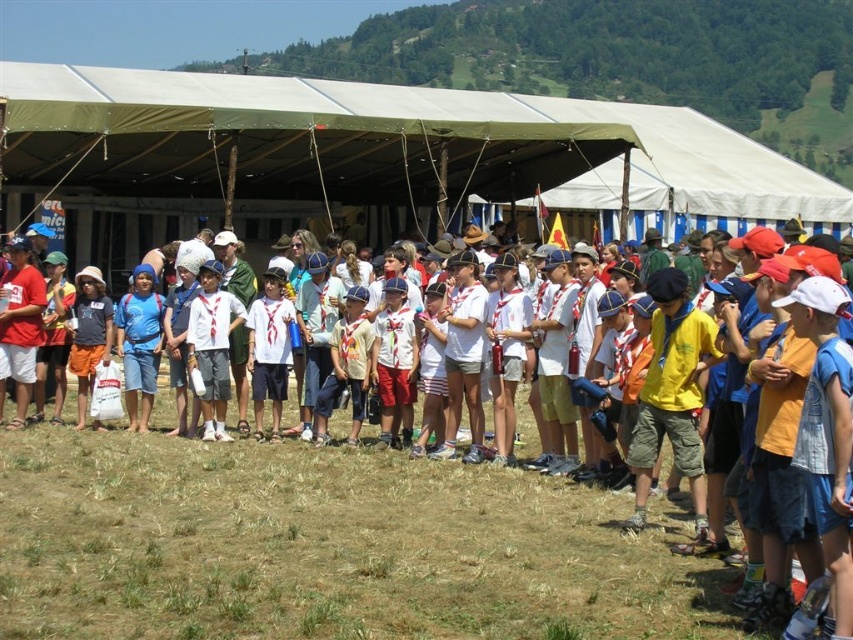
You are a photographer standing in front of the group of children. You notice a white cotton shirt at center and a matte blue shorts at center. Which item is positioned closer to you?

The white cotton shirt at center is closer to the viewer than the matte blue shorts at center.

In the scene shown: Where is the white cotton shirt at center located in the image?

The white cotton shirt at center is located at point 0.855 on the x axis and 0.385 on the y axis.

You are a photographer trying to capture a candid shot of the children in the scene. You notice two key items of clothing at the center of the image. Which one is positioned to the right of the other? The white cotton shirt at center or the matte blue shorts at center?

The white cotton shirt at center is positioned to the right of the matte blue shorts at center.